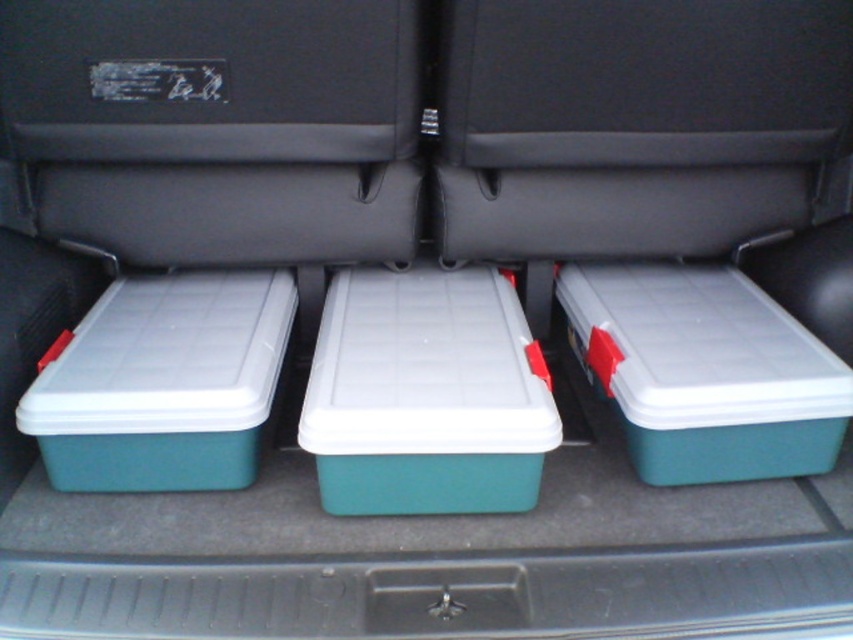
You need to place a rectangular package that is 1 meter long into the trunk. The package must be placed either on the teal plastic storage box at center or the green plastic storage box at left. Which box should you choose to ensure the package fits entirely on top?

The teal plastic storage box at center is larger in size than the green plastic storage box at left, so the teal plastic storage box at center can accommodate the 1 meter long package better.

You are trying to place a 1.2 meter long item in the trunk. The item must be placed so that its center aligns with the point at point (643, 148). Will the item fit entirely within the trunk if placed there?

The point (643, 148) is 1.32 meters from the camera. Since the item is 1.2 meters long, placing it so its center aligns with this point would leave 0.12 meters of space on each side along the length, meaning it will fit within the trunk.